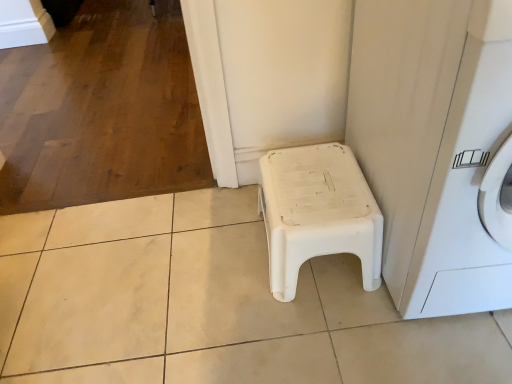
Where is `free space to the left of white plastic stool at center`? This screenshot has width=512, height=384. free space to the left of white plastic stool at center is located at coordinates (214, 264).